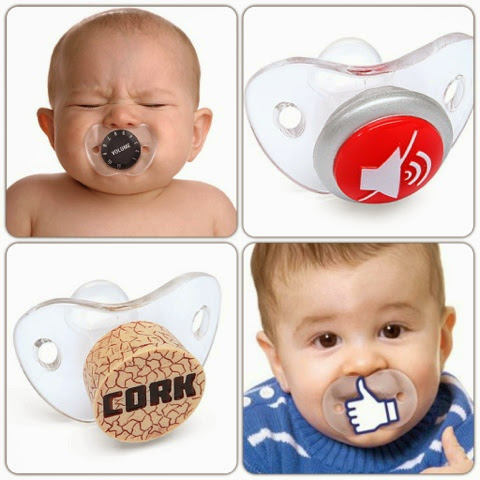
You are a GUI agent. You are given a task and a screenshot of the screen. Output one action in this format:
    pyautogui.click(x=<x>, y=<y>)
    Task: Click on the pacifier
    The width and height of the screenshot is (480, 480).
    Given the screenshot: What is the action you would take?
    pyautogui.click(x=110, y=150), pyautogui.click(x=131, y=345), pyautogui.click(x=376, y=128), pyautogui.click(x=363, y=407)